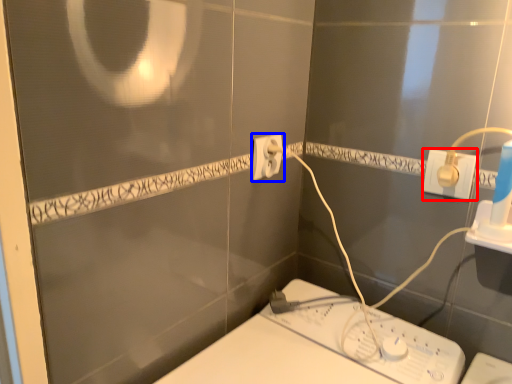
Question: Which point is further to the camera, power plugs and sockets (highlighted by a red box) or power plugs and sockets (highlighted by a blue box)?

Choices:
 (A) power plugs and sockets
 (B) power plugs and sockets

Answer: (B)